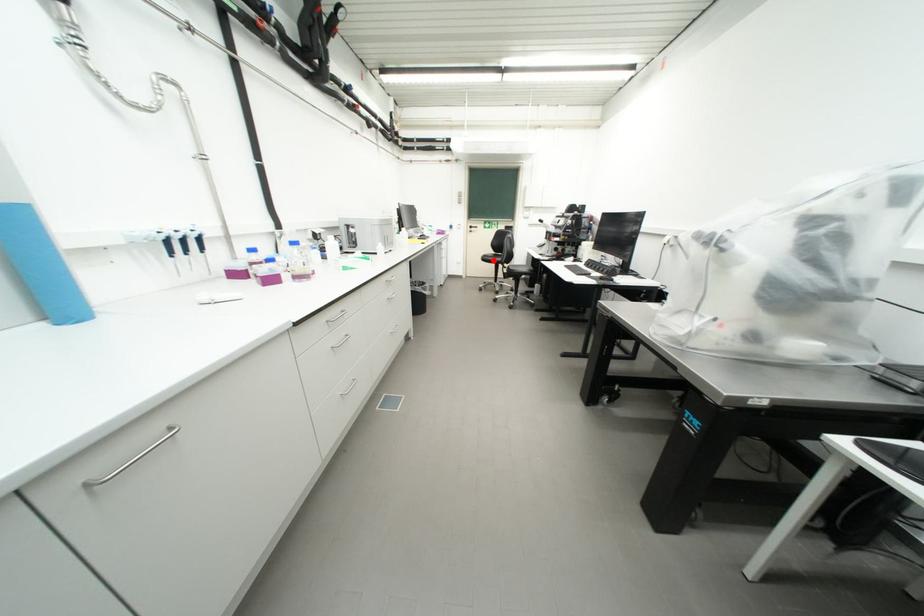
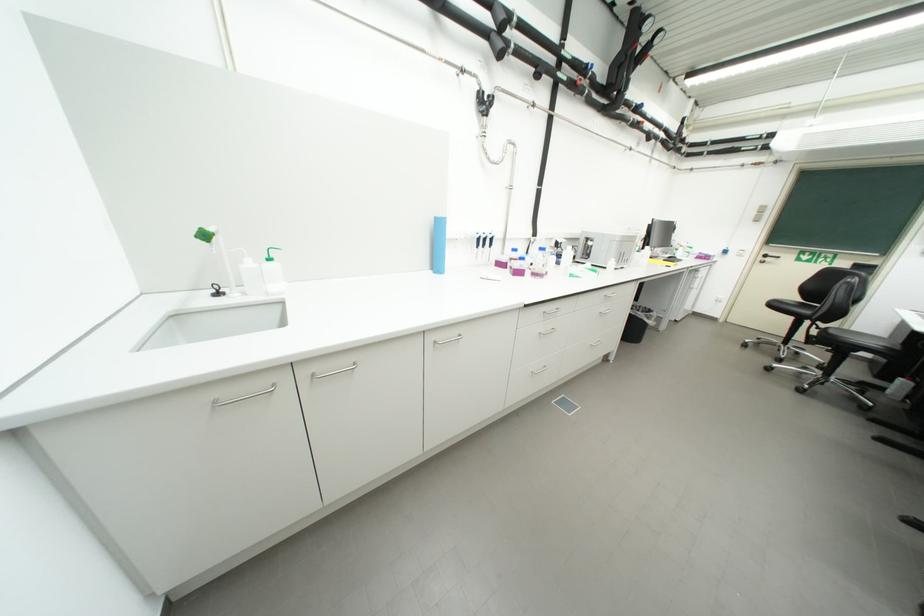
The point at the highlighted location is marked in the first image. Where is the corresponding point in the second image?

(783, 307)